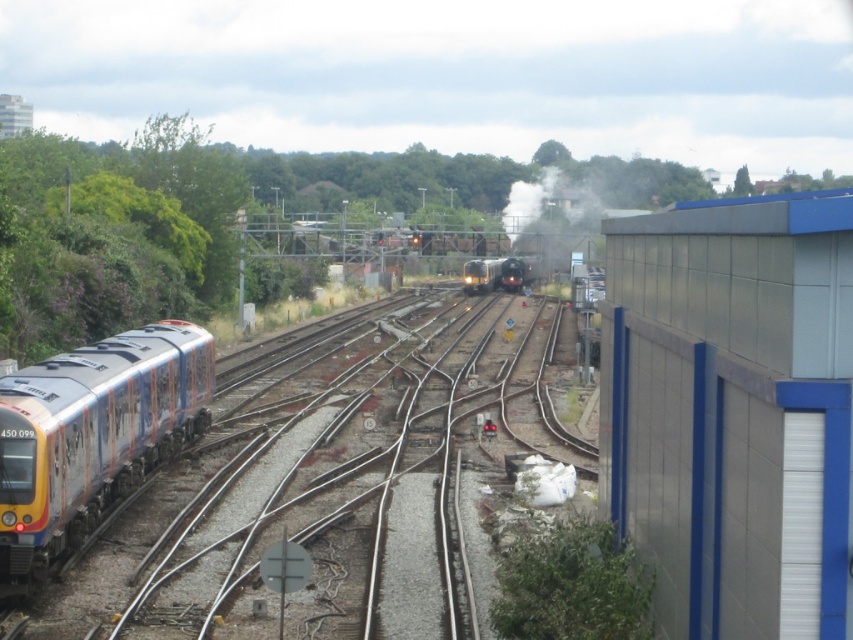
Question: Can you confirm if metallic train tracks at left is positioned to the right of metallic gray building at right?

Choices:
 (A) yes
 (B) no

Answer: (B)

Question: Which object appears farthest from the camera in this image?

Choices:
 (A) metallic gray building at right
 (B) metallic train tracks at left

Answer: (B)

Question: Does metallic gray building at right appear on the left side of shiny black train at center?

Choices:
 (A) yes
 (B) no

Answer: (A)

Question: Is metallic train tracks at left above polished metallic train at left?

Choices:
 (A) yes
 (B) no

Answer: (A)

Question: Estimate the real-world distances between objects in this image. Which object is farther from the polished metallic train at left?

Choices:
 (A) shiny black train at center
 (B) metallic train tracks at left
 (C) metallic gray building at right
 (D) black smoke at center

Answer: (A)

Question: Which point is farther from the camera taking this photo?

Choices:
 (A) (720, 540)
 (B) (462, 282)

Answer: (B)